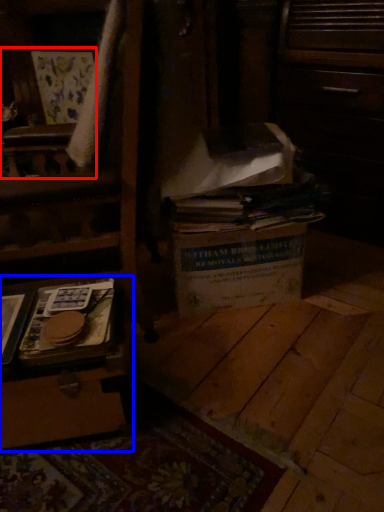
Question: Among these objects, which one is farthest to the camera, armchair (highlighted by a red box) or vanity (highlighted by a blue box)?

Choices:
 (A) armchair
 (B) vanity

Answer: (A)